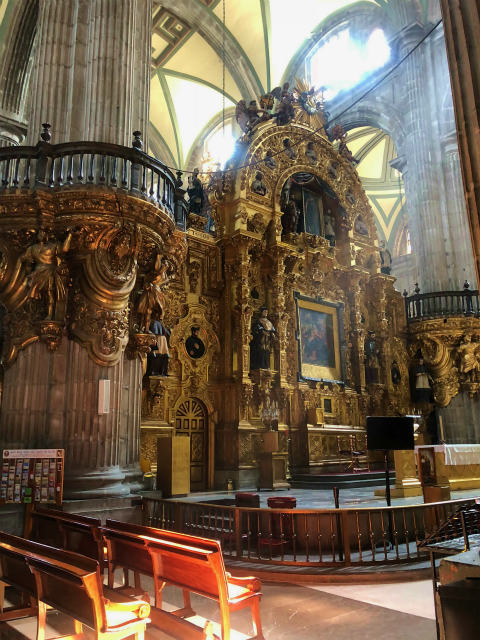
Locate an element on the screen. altar is located at coordinates (436, 452).